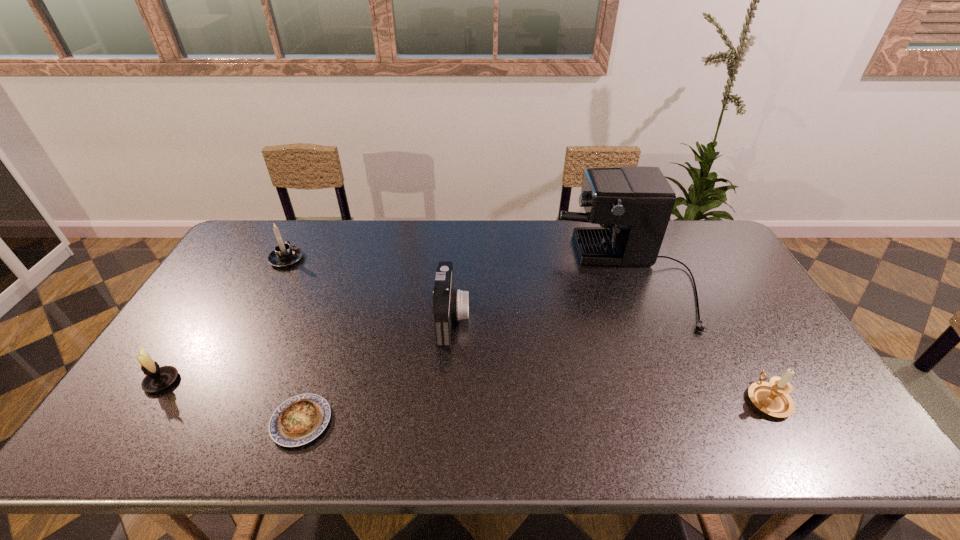
Image resolution: width=960 pixels, height=540 pixels. Identify the location of the tallest object. (633, 205).

Where is `the fifth object from right to left`? Image resolution: width=960 pixels, height=540 pixels. the fifth object from right to left is located at coordinates (284, 255).

Where is `the second candle holder from left to right`? the second candle holder from left to right is located at coordinates (284, 255).

Identify the location of the third object from right to left. The height and width of the screenshot is (540, 960). (448, 304).

Where is `the leftmost candle holder`? The height and width of the screenshot is (540, 960). the leftmost candle holder is located at coordinates (157, 378).

You are a GUI agent. You are given a task and a screenshot of the screen. Output one action in this format:
    pyautogui.click(x=<x>, y=<y>)
    Task: Click on the rightmost candle holder
    This screenshot has width=960, height=540.
    Given the screenshot: What is the action you would take?
    pyautogui.click(x=772, y=397)

This screenshot has width=960, height=540. What are the coordinates of `the third object from left to right` in the screenshot? It's located at (297, 421).

The width and height of the screenshot is (960, 540). What are the coordinates of `quiche` in the screenshot? It's located at (297, 421).

Where is `vacant area situated 0.130m on the front-facing side of the coffee maker`? vacant area situated 0.130m on the front-facing side of the coffee maker is located at coordinates (522, 277).

Where is `free location located on the front-facing side of the coffee maker`? free location located on the front-facing side of the coffee maker is located at coordinates (540, 277).